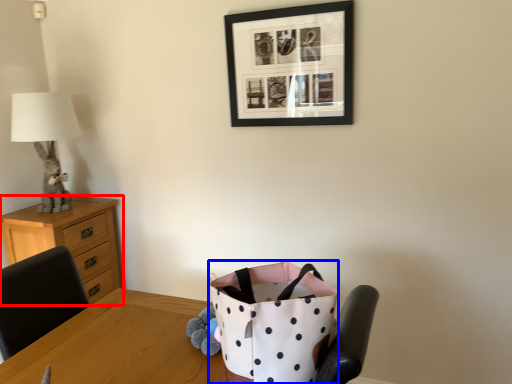
Question: Among these objects, which one is nearest to the camera, chest of drawers (highlighted by a red box) or shopping bag (highlighted by a blue box)?

Choices:
 (A) chest of drawers
 (B) shopping bag

Answer: (B)